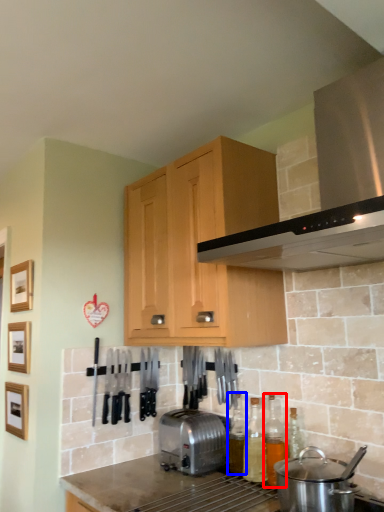
Question: Which point is closer to the camera, bottle (highlighted by a red box) or bottle (highlighted by a blue box)?

Choices:
 (A) bottle
 (B) bottle

Answer: (A)